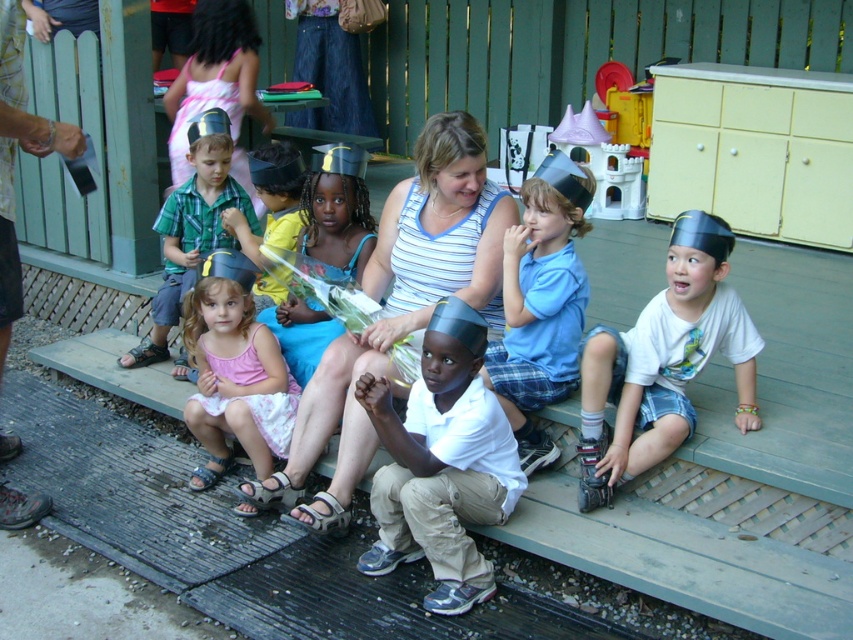
You are standing at the origin point in the image and want to locate the white matte shirt at center. Which direction should you move to find it?

The white matte shirt at center is located at coordinates approximately 0.725 along the x axis and 0.518 along the y axis. Since the origin is at the bottom left corner, you should move to the right and slightly upward from your current position to reach it.

You are a photographer at the event and want to ensure both the white matte shirt at center and the yellow fabric shirt at center are clearly visible in your photo. Based on their positions, which shirt should you focus on first to ensure both are in focus?

The white matte shirt at center is in front of the yellow fabric shirt at center, so focusing on the white matte shirt at center first will ensure both are in focus since it is closer to the camera.